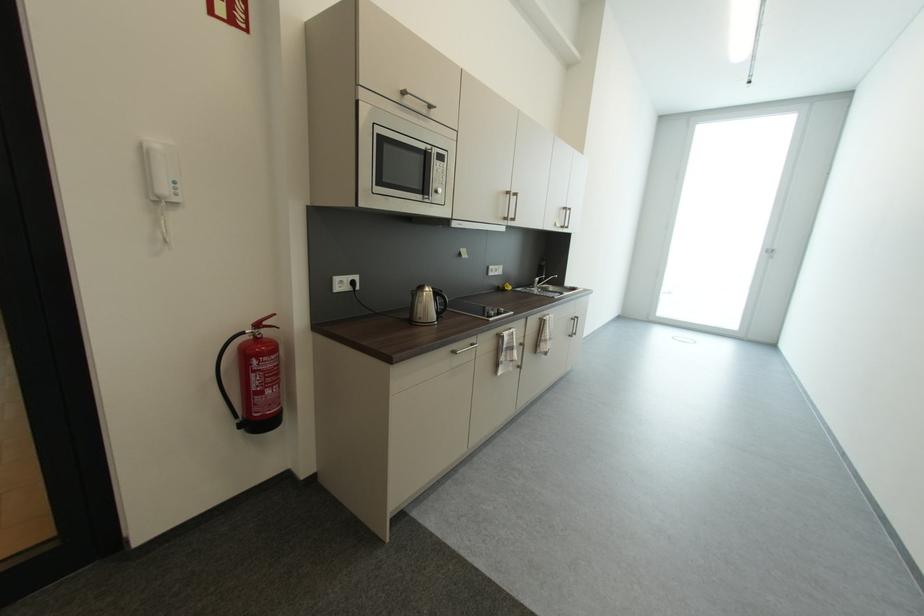
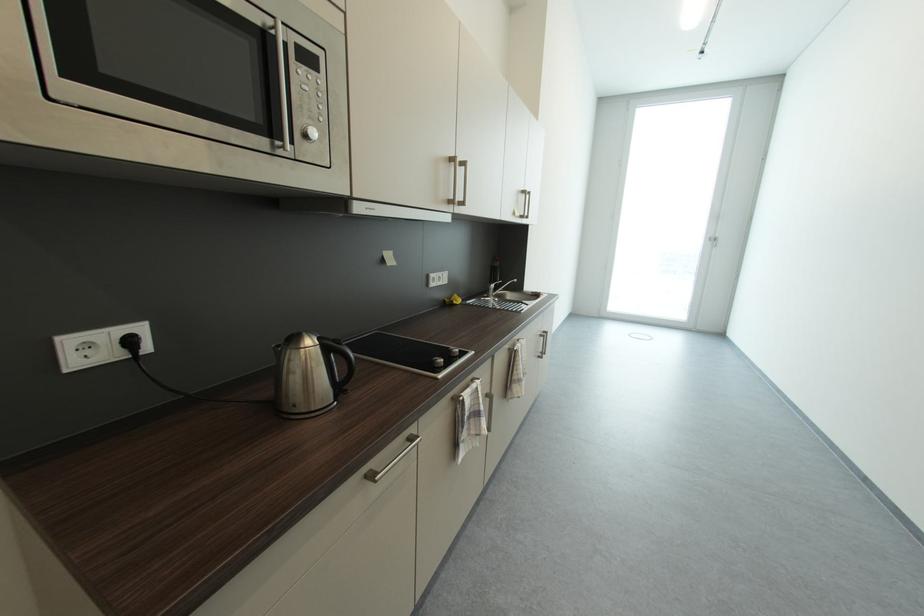
Question: I am providing you with two images of the same scene from different viewpoints. After the viewpoint changes to image2, which objects are now occluded?

Choices:
 (A) faucet handle
 (B) yellow sticky note
 (C) kitchen towel
 (D) none of these

Answer: (D)